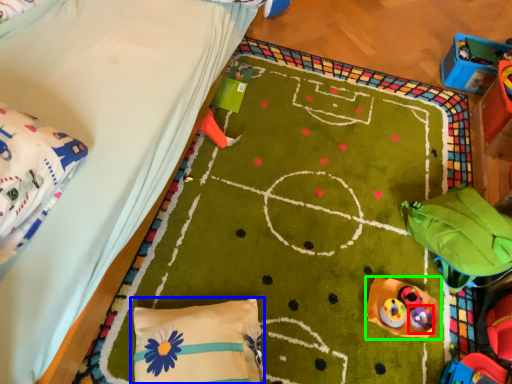
Question: Which is farther away from toy (highlighted by a red box)? pillow (highlighted by a blue box) or toy (highlighted by a green box)?

Choices:
 (A) pillow
 (B) toy

Answer: (A)